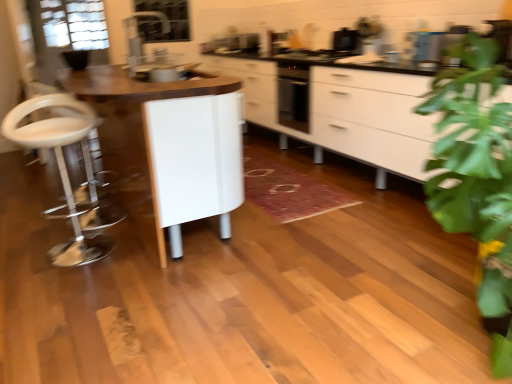
The height and width of the screenshot is (384, 512). What do you see at coordinates (67, 33) in the screenshot?
I see `transparent glass door at upper left` at bounding box center [67, 33].

What is the approximate width of transparent glass door at upper left?

The width of transparent glass door at upper left is 37.90 centimeters.

Identify the location of white glossy cabinet at center. (350, 112).

Is clear glass window screen at upper center in contact with white glossy table at center?

No, clear glass window screen at upper center is not touching white glossy table at center.

How many degrees apart are the facing directions of clear glass window screen at upper center and white glossy table at center?

The facing directions of clear glass window screen at upper center and white glossy table at center are 91.6 degrees apart.

From a real-world perspective, is clear glass window screen at upper center physically located above or below white glossy table at center?

clear glass window screen at upper center is situated higher than white glossy table at center in the real world.

From the image's perspective, is clear glass window screen at upper center on white glossy table at center?

Yes, from the image's perspective, clear glass window screen at upper center is on top of white glossy table at center.

Does transparent glass door at upper left have a greater height compared to white glossy cabinet at center?

Incorrect, the height of transparent glass door at upper left is not larger of that of white glossy cabinet at center.

Are transparent glass door at upper left and white glossy cabinet at center far apart?

Absolutely, transparent glass door at upper left is distant from white glossy cabinet at center.

Which is behind, transparent glass door at upper left or white glossy cabinet at center?

transparent glass door at upper left is behind.

Measure the distance from transparent glass door at upper left to white glossy cabinet at center.

transparent glass door at upper left is 5.55 feet from white glossy cabinet at center.

Is point (179, 20) positioned before point (350, 42)?

That is False.

How different are the orientations of clear glass window screen at upper center and black glossy toaster at upper right in degrees?

89 degrees separate the facing orientations of clear glass window screen at upper center and black glossy toaster at upper right.

Looking at this image, considering the positions of objects clear glass window screen at upper center and black glossy toaster at upper right in the image provided, who is more to the left, clear glass window screen at upper center or black glossy toaster at upper right?

→ Positioned to the left is clear glass window screen at upper center.

From the image's perspective, which is below, clear glass window screen at upper center or black glossy toaster at upper right?

From the image's view, black glossy toaster at upper right is below.

Considering the sizes of black glossy toaster at upper right and white glossy table at center in the image, is black glossy toaster at upper right taller or shorter than white glossy table at center?

Considering their sizes, black glossy toaster at upper right has less height than white glossy table at center.

From a real-world perspective, which is physically above, black glossy toaster at upper right or white glossy table at center?

From a 3D spatial view, black glossy toaster at upper right is above.

Who is bigger, black glossy toaster at upper right or white glossy table at center?

white glossy table at center is bigger.

From the picture: Between black glossy toaster at upper right and white glossy table at center, which one appears on the left side from the viewer's perspective?

From the viewer's perspective, white glossy table at center appears more on the left side.

From the picture: From a real-world perspective, is transparent glass door at upper left located higher than white glossy swivel chair at left?

Indeed, from a real-world perspective, transparent glass door at upper left stands above white glossy swivel chair at left.

Where is `glass door on the left of white glossy swivel chair at left`? This screenshot has height=384, width=512. glass door on the left of white glossy swivel chair at left is located at coordinates (67, 33).

Between transparent glass door at upper left and white glossy swivel chair at left, which one appears on the left side from the viewer's perspective?

transparent glass door at upper left.

The image size is (512, 384). Identify the location of appliance located behind the white glossy swivel chair at left. (x=346, y=40).

Would you say black glossy toaster at upper right is part of white glossy swivel chair at left's contents?

Definitely not — black glossy toaster at upper right is not inside white glossy swivel chair at left.

From their relative heights in the image, would you say white glossy swivel chair at left is taller or shorter than black glossy toaster at upper right?

Result: Considering their sizes, white glossy swivel chair at left has more height than black glossy toaster at upper right.

Does white glossy swivel chair at left turn towards black glossy toaster at upper right?

No, white glossy swivel chair at left is not turned towards black glossy toaster at upper right.

Is transparent glass door at upper left looking in the opposite direction of white glossy table at center?

No, white glossy table at center is not at the back of transparent glass door at upper left.

Does transparent glass door at upper left appear on the right side of white glossy table at center?

In fact, transparent glass door at upper left is to the left of white glossy table at center.

Looking at this image, is transparent glass door at upper left smaller than white glossy table at center?

Yes.

You are a GUI agent. You are given a task and a screenshot of the screen. Output one action in this format:
    pyautogui.click(x=<x>, y=<y>)
    Task: Click on the table below the clear glass window screen at upper center (from a real-world perspective)
    The image size is (512, 384).
    Given the screenshot: What is the action you would take?
    pyautogui.click(x=138, y=85)

The width and height of the screenshot is (512, 384). In order to click on cabinetry in front of the transparent glass door at upper left in this screenshot , I will do 350,112.

Based on their spatial positions, is white glossy cabinet at center or white glossy swivel chair at left further from transparent glass door at upper left?

Based on the image, white glossy cabinet at center appears to be further to transparent glass door at upper left.

Considering their positions, is white glossy swivel chair at left positioned closer to white glossy cabinet at center than black glossy toaster at upper right?

The object closer to white glossy cabinet at center is black glossy toaster at upper right.

From the image, which object appears to be nearer to white glossy swivel chair at left, transparent glass door at upper left or white glossy cabinet at center?

Among the two, transparent glass door at upper left is located nearer to white glossy swivel chair at left.

Looking at the image, which one is located further to white glossy table at center, clear glass window screen at upper center or transparent glass door at upper left?

clear glass window screen at upper center is further to white glossy table at center.

From the image, which object appears to be nearer to white glossy cabinet at center, black glossy toaster at upper right or white glossy table at center?

black glossy toaster at upper right is closer to white glossy cabinet at center.

Considering their positions, is white glossy swivel chair at left positioned further to white glossy table at center than transparent glass door at upper left?

transparent glass door at upper left.

Estimate the real-world distances between objects in this image. Which object is further from white glossy cabinet at center, white glossy table at center or clear glass window screen at upper center?

The object further to white glossy cabinet at center is white glossy table at center.

Estimate the real-world distances between objects in this image. Which object is further from black glossy toaster at upper right, clear glass window screen at upper center or white glossy cabinet at center?

clear glass window screen at upper center.

Where is `glass door located between white glossy cabinet at center and clear glass window screen at upper center in the depth direction`? This screenshot has width=512, height=384. glass door located between white glossy cabinet at center and clear glass window screen at upper center in the depth direction is located at coordinates (67, 33).

Image resolution: width=512 pixels, height=384 pixels. Find the location of `swivel chair positioned between white glossy table at center and transparent glass door at upper left from near to far`. swivel chair positioned between white glossy table at center and transparent glass door at upper left from near to far is located at coordinates (61, 170).

At what (x,y) coordinates should I click in order to perform the action: click on cabinetry between transparent glass door at upper left and black glossy toaster at upper right. Please return your answer as a coordinate pair (x, y). The height and width of the screenshot is (384, 512). Looking at the image, I should click on (350, 112).

This screenshot has height=384, width=512. What are the coordinates of `cabinetry positioned between white glossy table at center and clear glass window screen at upper center from near to far` in the screenshot? It's located at (350, 112).